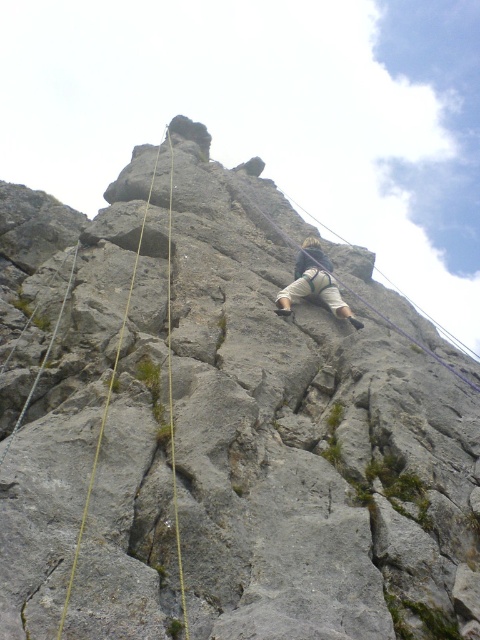
Question: In this image, where is tan fabric pants at center located relative to yellow rope at center?

Choices:
 (A) right
 (B) left

Answer: (A)

Question: Can you confirm if tan fabric pants at center is smaller than yellow rope at center?

Choices:
 (A) no
 (B) yes

Answer: (B)

Question: Which of the following is the farthest from the observer?

Choices:
 (A) (78, 557)
 (B) (310, 262)

Answer: (B)

Question: Among these objects, which one is nearest to the camera?

Choices:
 (A) yellow rope at center
 (B) tan fabric pants at center

Answer: (A)

Question: Among these points, which one is farthest from the camera?

Choices:
 (A) (95, 467)
 (B) (289, 296)

Answer: (B)

Question: Is tan fabric pants at center above yellow rope at center?

Choices:
 (A) yes
 (B) no

Answer: (B)